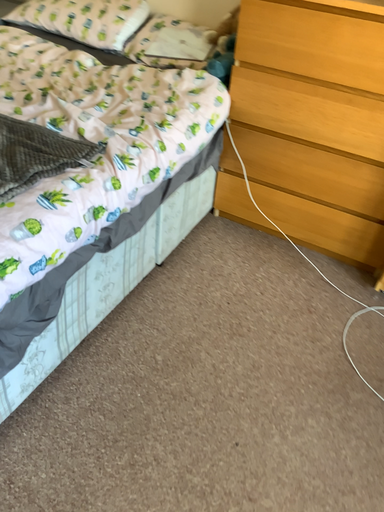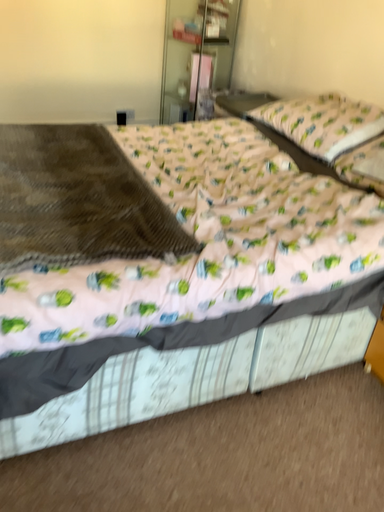
Question: How did the camera likely rotate when shooting the video?

Choices:
 (A) rotated downward
 (B) rotated upward

Answer: (B)